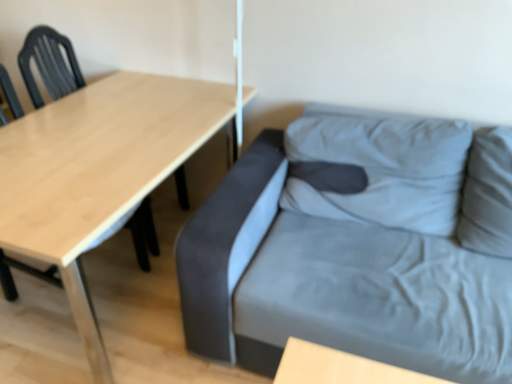
The height and width of the screenshot is (384, 512). I want to click on wooden table at left, so click(98, 172).

The height and width of the screenshot is (384, 512). In order to click on wooden table at left in this screenshot , I will do `click(98, 172)`.

Which of these two, matte black chair at left or wooden table at left, is wider?

Wider between the two is wooden table at left.

Is matte black chair at left smaller than wooden table at left?

Indeed, matte black chair at left has a smaller size compared to wooden table at left.

Considering the relative positions of matte black chair at left and wooden table at left in the image provided, is matte black chair at left to the right of wooden table at left from the viewer's perspective?

In fact, matte black chair at left is to the left of wooden table at left.

Could you tell me if matte black chair at left is turned towards wooden table at left?

Yes, matte black chair at left is oriented towards wooden table at left.

Is wooden table at left not close to suede gray couch at right?

No, there isn't a large distance between wooden table at left and suede gray couch at right.

How many degrees apart are the facing directions of wooden table at left and suede gray couch at right?

They differ by 88.9 degrees in their facing directions.

Identify the location of table behind the suede gray couch at right. (98, 172).

Looking at this image, does wooden table at left turn towards suede gray couch at right?

Yes.

Is the position of suede gray couch at right more distant than that of wooden table at left?

No, suede gray couch at right is closer to the viewer.

The width and height of the screenshot is (512, 384). Find the location of `studio couch below the wooden table at left (from the image's perspective)`. studio couch below the wooden table at left (from the image's perspective) is located at coordinates (353, 251).

From the image's perspective, would you say suede gray couch at right is shown under wooden table at left?

Correct, suede gray couch at right appears lower than wooden table at left in the image.

Is suede gray couch at right touching wooden table at left?

They are not placed beside each other.

Which object is further away from the camera taking this photo, suede gray couch at right or matte black chair at left?

matte black chair at left is further away from the camera.

Is suede gray couch at right completely or partially outside of matte black chair at left?

Yes, suede gray couch at right is outside of matte black chair at left.

Looking at their sizes, would you say suede gray couch at right is wider or thinner than matte black chair at left?

suede gray couch at right is wider than matte black chair at left.

Is the surface of suede gray couch at right in direct contact with matte black chair at left?

suede gray couch at right and matte black chair at left are not in contact.

Considering the relative sizes of matte black chair at left and suede gray couch at right in the image provided, is matte black chair at left taller than suede gray couch at right?

Correct, matte black chair at left is much taller as suede gray couch at right.

What are the coordinates of `chair above the suede gray couch at right (from the image's perspective)` in the screenshot? It's located at (139, 233).

What's the angular difference between matte black chair at left and suede gray couch at right's facing directions?

93.3 degrees.

Does point (10, 285) appear closer or farther from the camera than point (240, 314)?

Point (10, 285) is positioned farther from the camera compared to point (240, 314).

Can you see wooden table at left touching matte black chair at left?

wooden table at left and matte black chair at left are clearly separated.

Is wooden table at left inside the boundaries of matte black chair at left, or outside?

wooden table at left is not inside matte black chair at left, it's outside.

Is point (97, 131) positioned behind point (146, 220)?

No, (97, 131) is closer to viewer.

Where is `chair behind the wooden table at left`? chair behind the wooden table at left is located at coordinates (139, 233).

Locate an element on the screen. table above the suede gray couch at right (from the image's perspective) is located at coordinates (98, 172).

Estimate the real-world distances between objects in this image. Which object is closer to suede gray couch at right, matte black chair at left or wooden table at left?

Among the two, wooden table at left is located nearer to suede gray couch at right.

When comparing their distances from suede gray couch at right, does wooden table at left or matte black chair at left seem closer?

wooden table at left is closer to suede gray couch at right.

Estimate the real-world distances between objects in this image. Which object is closer to wooden table at left, suede gray couch at right or matte black chair at left?

matte black chair at left.

Based on their spatial positions, is wooden table at left or suede gray couch at right closer to matte black chair at left?

wooden table at left.

Considering their positions, is suede gray couch at right positioned further to matte black chair at left than wooden table at left?

Among the two, suede gray couch at right is located further to matte black chair at left.

When comparing their distances from wooden table at left, does matte black chair at left or suede gray couch at right seem closer?

matte black chair at left is positioned closer to the anchor wooden table at left.

In order to click on table between matte black chair at left and suede gray couch at right in this screenshot , I will do `click(98, 172)`.